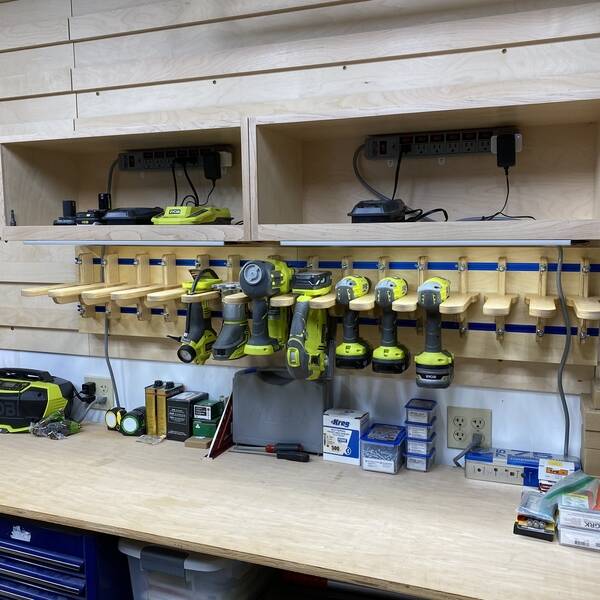
Locate an element on the screen. The image size is (600, 600). plastic bin is located at coordinates (200, 581).